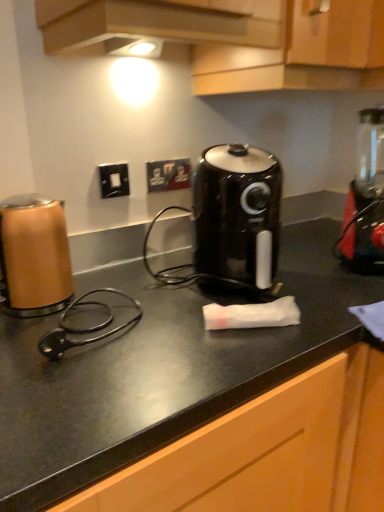
Locate an element on the screen. vacant area located to the right-hand side of copper metallic kettle at left is located at coordinates (130, 312).